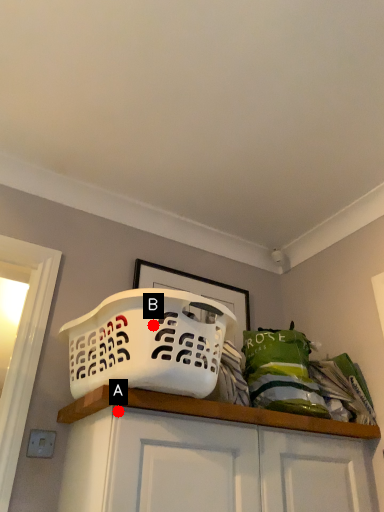
Question: Two points are circled on the image, labeled by A and B beside each circle. Which point is closer to the camera?

Choices:
 (A) A is closer
 (B) B is closer

Answer: (B)